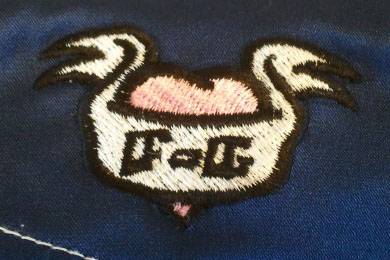
At what (x,y) coordinates should I click in order to perform the action: click on pink fabric. Please return your answer as a coordinate pair (x, y). The height and width of the screenshot is (260, 390). Looking at the image, I should click on (190, 97).